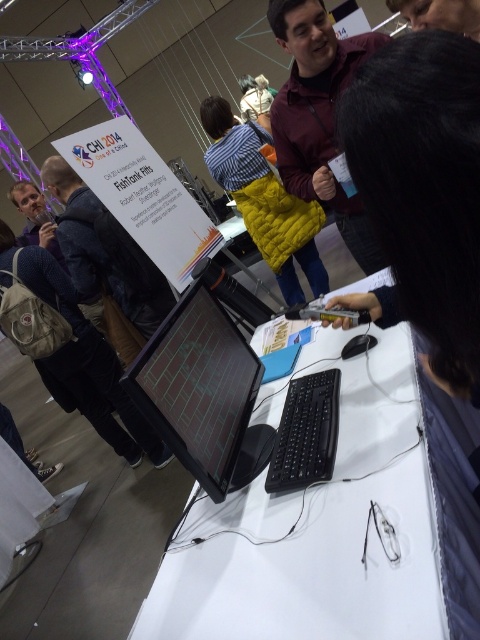
Question: Which of the following is the closest to the observer?

Choices:
 (A) matte black laptop at left
 (B) maroon quilted jacket at upper center

Answer: (B)

Question: Is black hair at upper center positioned behind matte black backpack at lower left?

Choices:
 (A) no
 (B) yes

Answer: (A)

Question: Which of the following is the farthest from the observer?

Choices:
 (A) pyautogui.click(x=38, y=220)
 (B) pyautogui.click(x=303, y=225)

Answer: (A)

Question: Is white glossy table at center to the right of black glossy monitor at center from the viewer's perspective?

Choices:
 (A) no
 (B) yes

Answer: (B)

Question: Which point appears farthest from the camera in this image?

Choices:
 (A) tap(213, 164)
 (B) tap(46, 208)

Answer: (B)

Question: Does black glossy monitor at center have a lesser width compared to matte black backpack at lower left?

Choices:
 (A) yes
 (B) no

Answer: (A)